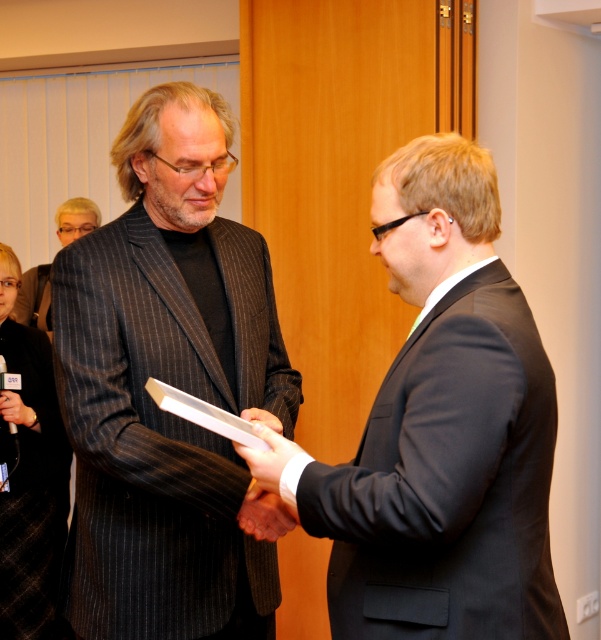
Does black suit at center appear under black pinstripe suit at lower left?

No, black suit at center is not below black pinstripe suit at lower left.

Who is more distant from viewer, (438, 568) or (37, 625)?

Point (37, 625)

This screenshot has width=601, height=640. What do you see at coordinates (444, 429) in the screenshot?
I see `black suit at center` at bounding box center [444, 429].

This screenshot has width=601, height=640. Find the location of `black suit at center`. black suit at center is located at coordinates (444, 429).

Is dark gray pinstripe suit at center thinner than black suit at center?

No, dark gray pinstripe suit at center is not thinner than black suit at center.

Is point (112, 296) less distant than point (450, 353)?

No, (112, 296) is further to viewer.

Does point (112, 600) come closer to viewer compared to point (338, 508)?

No, it is behind (338, 508).

You are a GUI agent. You are given a task and a screenshot of the screen. Output one action in this format:
    pyautogui.click(x=<x>, y=<y>)
    Task: Click on the dark gray pinstripe suit at center
    Image resolution: width=601 pixels, height=640 pixels.
    Given the screenshot: What is the action you would take?
    tap(171, 385)

Who is more forward, [84,209] or [281,452]?

Point [281,452] is in front.

Who is more forward, (59, 236) or (246, 464)?

→ Point (246, 464) is more forward.

You are a GUI agent. You are given a task and a screenshot of the screen. Output one action in this format:
    pyautogui.click(x=<x>, y=<y>)
    Task: Click on the black pinstripe suit at center
    This screenshot has width=601, height=640.
    Given the screenshot: What is the action you would take?
    pyautogui.click(x=34, y=298)